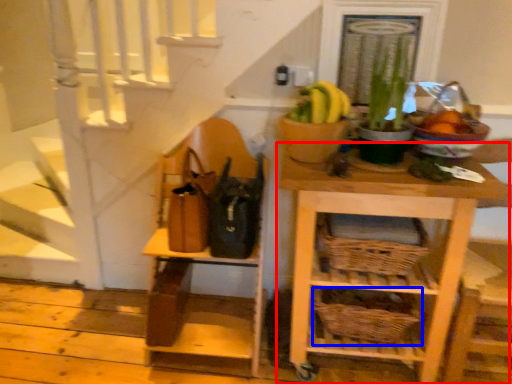
Question: Which point is closer to the camera, shelf (highlighted by a red box) or basket (highlighted by a blue box)?

Choices:
 (A) shelf
 (B) basket

Answer: (A)